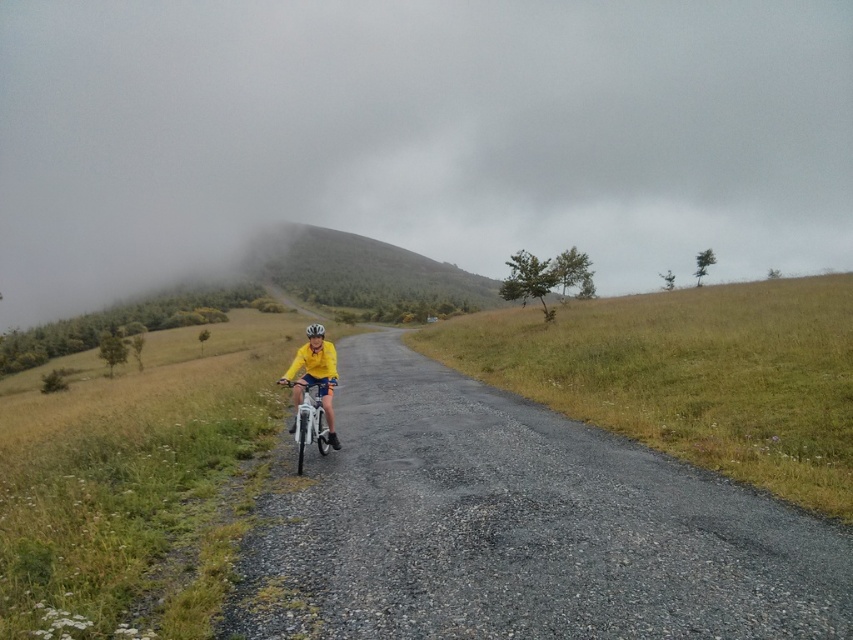
You are a hiker planning to cross the area shown in the image. You need to know which of the two hills, the foggy misty hillside at upper center or the green grassy hill at center, is larger in size to choose the best route. Which one is larger?

The foggy misty hillside at upper center is bigger than the green grassy hill at center, so the foggy misty hillside at upper center is the larger one.

You are a cyclist planning to ride through this rural area. You notice the foggy misty hillside at upper center and the yellow matte jacket at center. Which object is higher in the image?

The foggy misty hillside at upper center is positioned over the yellow matte jacket at center, so it is higher in the image.